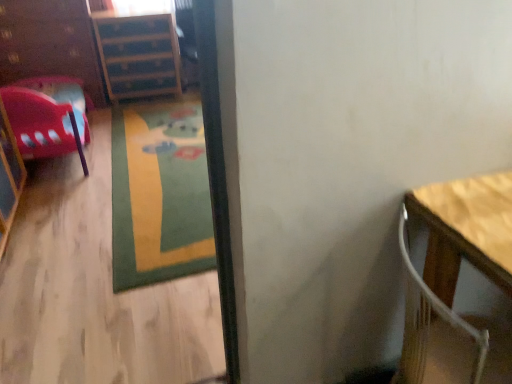
Question: From the image's perspective, would you say wooden file cabinet at upper left is shown under brushed wood dresser at left?

Choices:
 (A) yes
 (B) no

Answer: (B)

Question: Does wooden file cabinet at upper left have a larger size compared to brushed wood dresser at left?

Choices:
 (A) no
 (B) yes

Answer: (B)

Question: Is wooden file cabinet at upper left to the right of brushed wood dresser at left from the viewer's perspective?

Choices:
 (A) no
 (B) yes

Answer: (B)

Question: Is there a large distance between wooden file cabinet at upper left and brushed wood dresser at left?

Choices:
 (A) no
 (B) yes

Answer: (A)

Question: Could you tell me if wooden file cabinet at upper left is facing brushed wood dresser at left?

Choices:
 (A) no
 (B) yes

Answer: (A)

Question: Relative to brushed wood dresser at left, is matte plastic chair at left in front or behind?

Choices:
 (A) behind
 (B) front

Answer: (B)

Question: Is matte plastic chair at left situated inside brushed wood dresser at left or outside?

Choices:
 (A) outside
 (B) inside

Answer: (A)

Question: Is point (75, 144) positioned closer to the camera than point (59, 52)?

Choices:
 (A) farther
 (B) closer

Answer: (B)

Question: From the image's perspective, is matte plastic chair at left above or below brushed wood dresser at left?

Choices:
 (A) below
 (B) above

Answer: (A)

Question: Does point (198, 124) appear closer or farther from the camera than point (56, 61)?

Choices:
 (A) farther
 (B) closer

Answer: (B)

Question: Is green carpet at center to the left or to the right of brushed wood dresser at left in the image?

Choices:
 (A) right
 (B) left

Answer: (A)

Question: From the image's perspective, relative to brushed wood dresser at left, is green carpet at center above or below?

Choices:
 (A) below
 (B) above

Answer: (A)

Question: From a real-world perspective, is green carpet at center above or below brushed wood dresser at left?

Choices:
 (A) below
 (B) above

Answer: (A)

Question: From a real-world perspective, is wooden table at right positioned above or below wooden floor at lower left?

Choices:
 (A) below
 (B) above

Answer: (A)

Question: Choose the correct answer: Is wooden table at right inside wooden floor at lower left or outside it?

Choices:
 (A) inside
 (B) outside

Answer: (B)